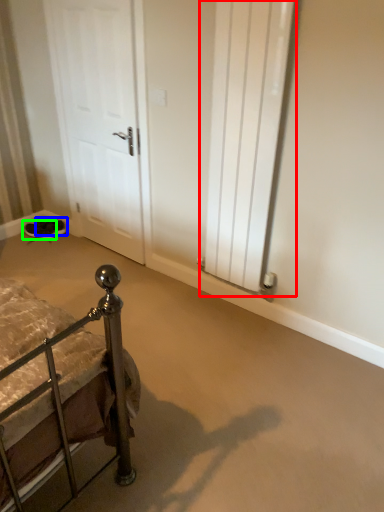
Question: Which object is the farthest from radiator (highlighted by a red box)? Choose among these: footwear (highlighted by a blue box) or footwear (highlighted by a green box).

Choices:
 (A) footwear
 (B) footwear

Answer: (B)